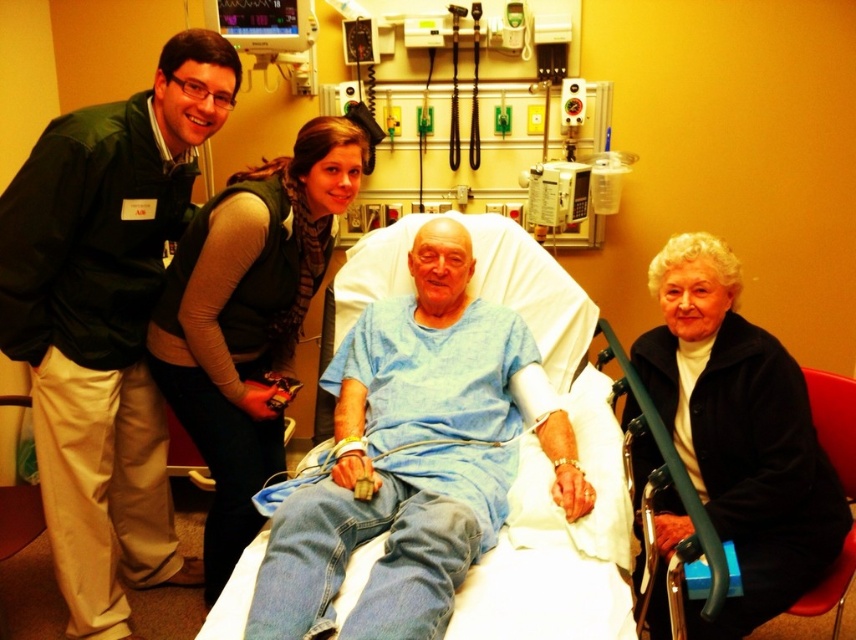
Between point (474, 544) and point (373, 198), which one is positioned in front?

Point (474, 544)

Is blue cotton shirt at center above metallic medical monitor at upper center?

Actually, blue cotton shirt at center is below metallic medical monitor at upper center.

Image resolution: width=856 pixels, height=640 pixels. I want to click on blue cotton shirt at center, so click(x=406, y=456).

You are a GUI agent. You are given a task and a screenshot of the screen. Output one action in this format:
    pyautogui.click(x=<x>, y=<y>)
    Task: Click on the blue cotton shirt at center
    The height and width of the screenshot is (640, 856).
    Given the screenshot: What is the action you would take?
    pyautogui.click(x=406, y=456)

Which is below, dark green vest at upper left or metallic medical monitor at upper center?

Positioned lower is dark green vest at upper left.

Can you confirm if dark green vest at upper left is smaller than metallic medical monitor at upper center?

Correct, dark green vest at upper left occupies less space than metallic medical monitor at upper center.

This screenshot has width=856, height=640. Describe the element at coordinates (248, 317) in the screenshot. I see `dark green vest at upper left` at that location.

Identify the location of dark green vest at upper left. This screenshot has height=640, width=856. (248, 317).

Is green fabric vest at upper left smaller than black fleece jacket at lower right?

No.

Between green fabric vest at upper left and black fleece jacket at lower right, which one appears on the right side from the viewer's perspective?

black fleece jacket at lower right

What do you see at coordinates (107, 321) in the screenshot? I see `green fabric vest at upper left` at bounding box center [107, 321].

You are a GUI agent. You are given a task and a screenshot of the screen. Output one action in this format:
    pyautogui.click(x=<x>, y=<y>)
    Task: Click on the green fabric vest at upper left
    
    Given the screenshot: What is the action you would take?
    pyautogui.click(x=107, y=321)